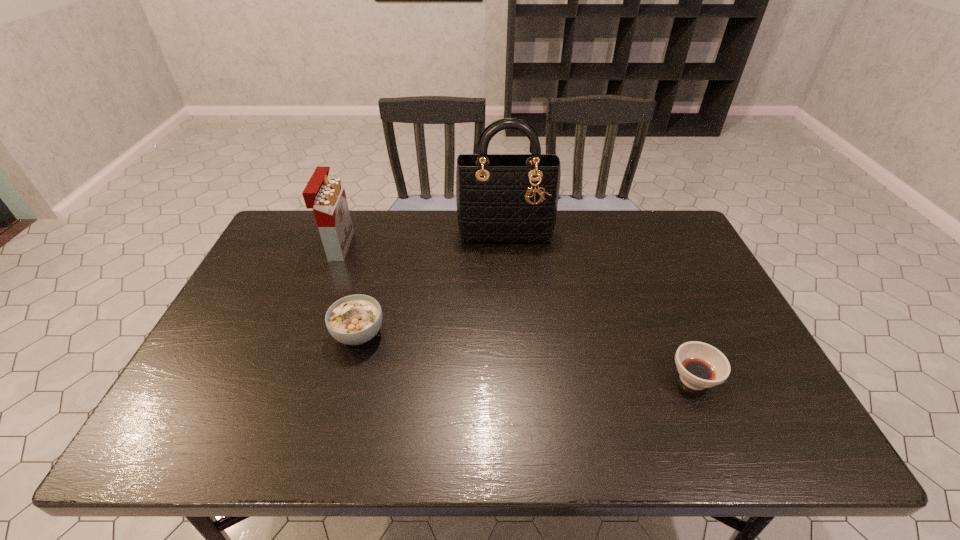
This screenshot has width=960, height=540. In the image, there is a desktop. Find the location of `blank space at the near left corner`. blank space at the near left corner is located at coordinates (206, 448).

Find the location of a particular element. free spot at the near right corner of the desktop is located at coordinates point(785,427).

This screenshot has width=960, height=540. I want to click on vacant space in between the tallest object and the rightmost object, so click(600, 305).

The width and height of the screenshot is (960, 540). I want to click on vacant point located between the leftmost object and the taller soup bowl, so click(348, 290).

Locate an element on the screen. free space between the cigarette case and the rightmost object is located at coordinates (516, 312).

Identify the location of blank region between the left soup bowl and the second object from right to left. This screenshot has width=960, height=540. [432, 283].

This screenshot has height=540, width=960. Find the location of `empty space between the handbag and the cigarette case`. empty space between the handbag and the cigarette case is located at coordinates (422, 239).

You are a GUI agent. You are given a task and a screenshot of the screen. Output one action in this format:
    pyautogui.click(x=<x>, y=<y>)
    Task: Click on the vacant point located between the farther soup bowl and the tallest object
    The height and width of the screenshot is (540, 960).
    Given the screenshot: What is the action you would take?
    click(x=432, y=283)

The image size is (960, 540). What are the coordinates of `free space that is in between the left soup bowl and the tallest object` in the screenshot? It's located at (432, 283).

At what (x,y) coordinates should I click in order to perform the action: click on empty space between the farther soup bowl and the third object from left to right. Please return your answer as a coordinate pair (x, y). Looking at the image, I should click on (432, 283).